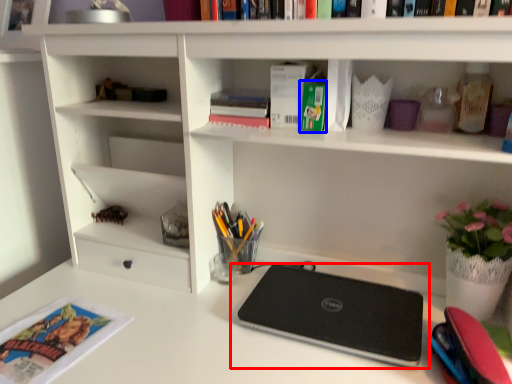
Question: Which point is closer to the camera, laptop (highlighted by a red box) or paperback book (highlighted by a blue box)?

Choices:
 (A) laptop
 (B) paperback book

Answer: (A)